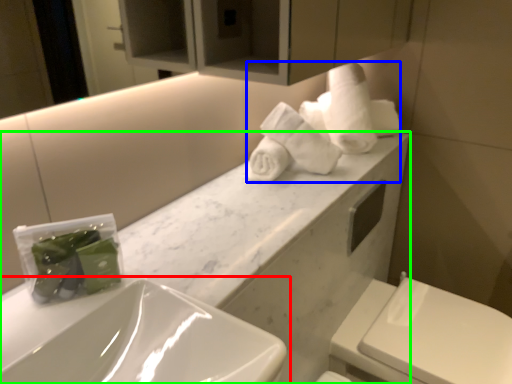
Question: Which is farther away from sink (highlighted by a red box)? bath towel (highlighted by a blue box) or porcelain (highlighted by a green box)?

Choices:
 (A) bath towel
 (B) porcelain

Answer: (A)